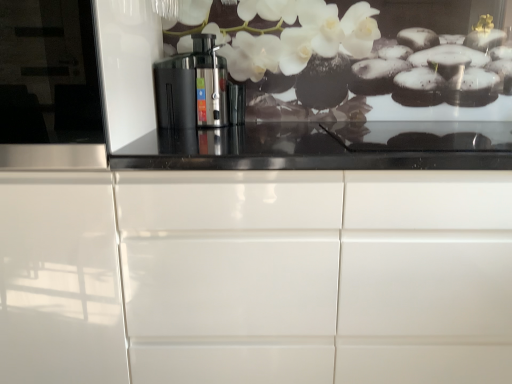
Question: Is black plastic juicer at center inside the boundaries of white glossy cabinet at center, or outside?

Choices:
 (A) outside
 (B) inside

Answer: (A)

Question: Is black plastic juicer at center in front of or behind white glossy cabinet at center in the image?

Choices:
 (A) behind
 (B) front

Answer: (A)

Question: Estimate the real-world distances between objects in this image. Which object is closer to the transparent glossy glass door at left?

Choices:
 (A) black plastic juicer at center
 (B) white glossy cabinet at center

Answer: (B)

Question: Considering the real-world distances, which object is farthest from the white glossy cabinet at center?

Choices:
 (A) transparent glossy glass door at left
 (B) black plastic juicer at center

Answer: (B)